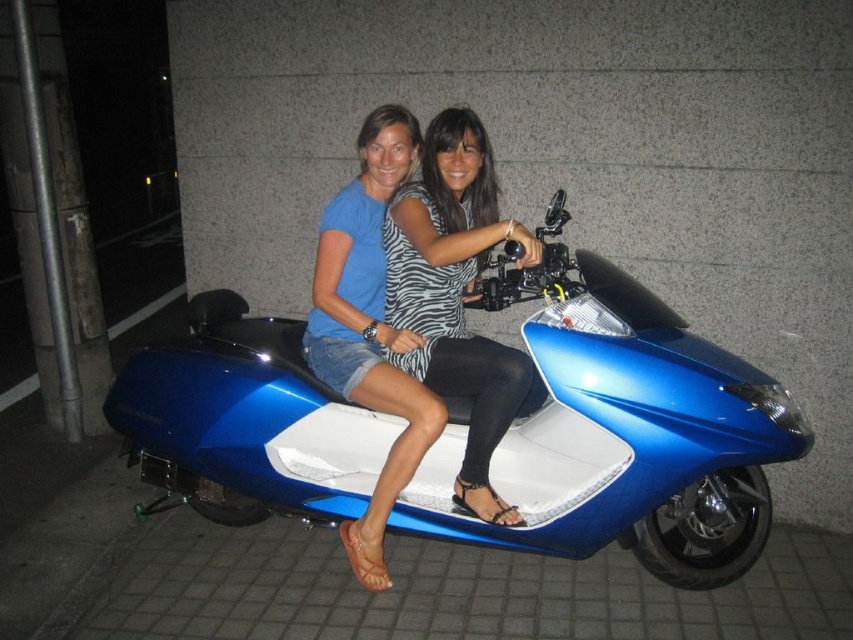
You are standing in front of the scooter and want to place a small sticker on the part of the scooter that is closer to you. Which point should you choose between point (680, 321) and point (397, 477)?

Point (680, 321) is further to the viewer than point (397, 477), so you should choose point (397, 477) since it is closer to you.

You are a photographer trying to capture the zebra print dress at center and the blue metallic scooter at center in a single shot. Based on their positions, which object is closer to the camera?

The zebra print dress at center is closer to the camera because the blue metallic scooter at center is below it, indicating the dress is in front.

You are a photographer setting up a night shoot. You have to position a spotlight so that it illuminates the blue metallic scooter at center and the striped fabric dress at center without casting shadows on the wall behind them. Based on their positions, where should you place the spotlight relative to the subjects?

The blue metallic scooter at center is located below the striped fabric dress at center. To avoid casting shadows on the wall, the spotlight should be placed above both the blue metallic scooter at center and the striped fabric dress at center so that the light falls downward, preventing shadows from reaching the wall.